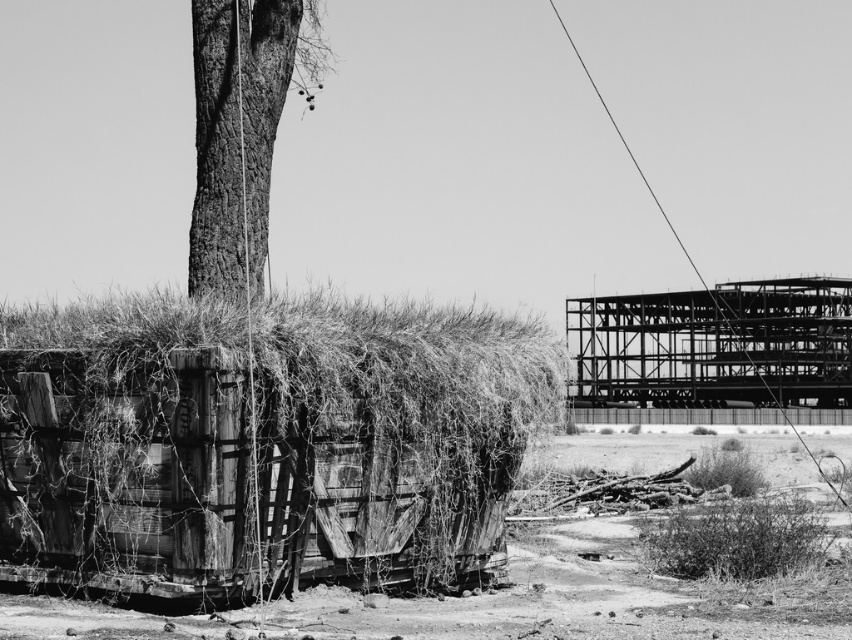
You are a photographer standing in front of the scene. You want to take a photo that includes both the metallic framework at right and the smooth bark tree at upper left. Which object will appear closer to you in the photo?

The metallic framework at right will appear closer to you in the photo because it is further to the viewer than the smooth bark tree at upper left.

You are a photographer wanting to capture the rusty wood hay at left and the dirt field at lower left in a single shot. Based on their positions, which object should you focus on first to ensure both are in frame?

The rusty wood hay at left is above the dirt field at lower left, so you should focus on the rusty wood hay at left first to ensure both are in frame.